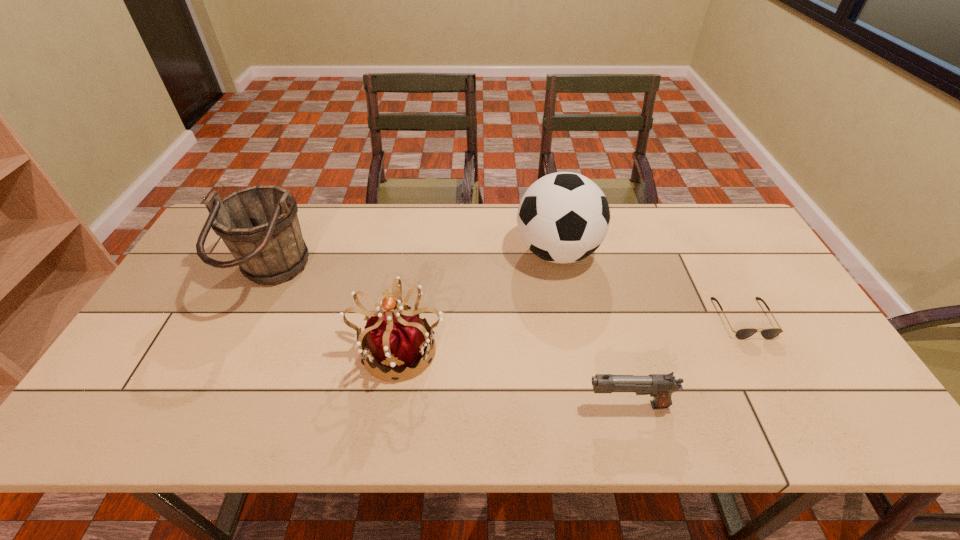
This screenshot has height=540, width=960. In order to click on vacant area located 0.120m in the direction the nearest object is aimed in this screenshot , I will do `click(533, 405)`.

Where is `free space located in the direction the nearest object is aimed`? free space located in the direction the nearest object is aimed is located at coordinates (506, 405).

In order to click on free space located in the direction the nearest object is aimed in this screenshot , I will do `click(555, 405)`.

You are a GUI agent. You are given a task and a screenshot of the screen. Output one action in this format:
    pyautogui.click(x=<x>, y=<y>)
    Task: Click on the free space located on the front-facing side of the rightmost object
    The image size is (960, 540).
    Given the screenshot: What is the action you would take?
    pyautogui.click(x=766, y=359)

Identify the location of soccer ball at the far edge. (563, 217).

Identify the location of bucket at the far edge. The width and height of the screenshot is (960, 540). (259, 225).

You are a GUI agent. You are given a task and a screenshot of the screen. Output one action in this format:
    pyautogui.click(x=<x>, y=<y>)
    Task: Click on the object at the near edge
    The width and height of the screenshot is (960, 540).
    Given the screenshot: What is the action you would take?
    pyautogui.click(x=660, y=386)

The height and width of the screenshot is (540, 960). Find the location of `object located in the left edge section of the desktop`. object located in the left edge section of the desktop is located at coordinates (259, 225).

Find the location of a particular element. The image size is (960, 540). object at the right edge is located at coordinates (771, 333).

Find the location of a particular element. This screenshot has height=540, width=960. object present at the far left corner is located at coordinates (259, 225).